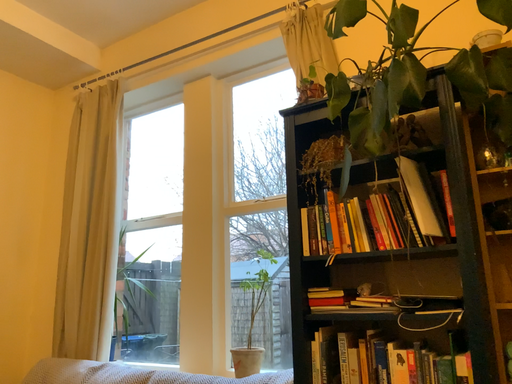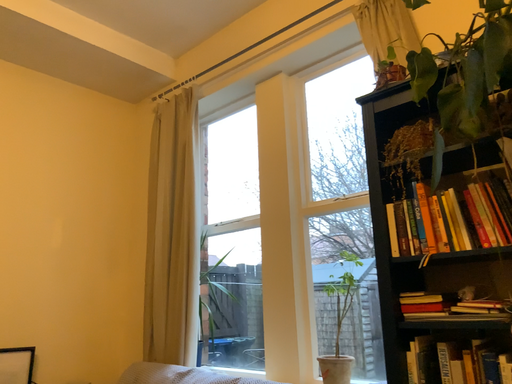
Question: Which way did the camera rotate in the video?

Choices:
 (A) rotated left
 (B) rotated right

Answer: (A)